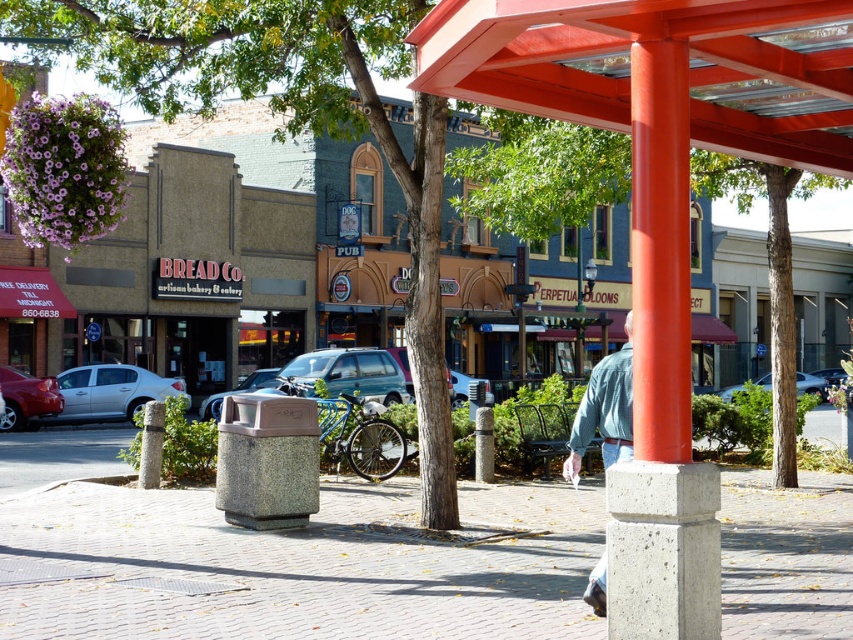
Is the position of smooth concrete pillar at center less distant than that of gray concrete post at lower left?

Yes, smooth concrete pillar at center is closer to the viewer.

Is smooth concrete pillar at center smaller than gray concrete post at lower left?

Incorrect, smooth concrete pillar at center is not smaller in size than gray concrete post at lower left.

Locate an element on the screen. smooth concrete pillar at center is located at coordinates (660, 385).

At what (x,y) coordinates should I click in order to perform the action: click on smooth concrete pillar at center. Please return your answer as a coordinate pair (x, y). This screenshot has height=640, width=853. Looking at the image, I should click on (660, 385).

Who is lower down, metallic red canopy at upper center or matte blue suv at center?

Positioned lower is matte blue suv at center.

Locate an element on the screen. metallic red canopy at upper center is located at coordinates (637, 70).

Is metallic red canopy at upper center positioned at the back of smooth concrete pillar at center?

Yes, it is.

What do you see at coordinates (637, 70) in the screenshot?
I see `metallic red canopy at upper center` at bounding box center [637, 70].

The height and width of the screenshot is (640, 853). In order to click on metallic red canopy at upper center in this screenshot , I will do `click(637, 70)`.